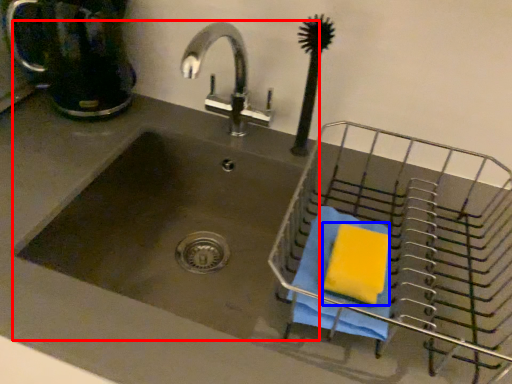
Question: Which object is closer to the camera taking this photo, sink (highlighted by a red box) or soap (highlighted by a blue box)?

Choices:
 (A) sink
 (B) soap

Answer: (B)